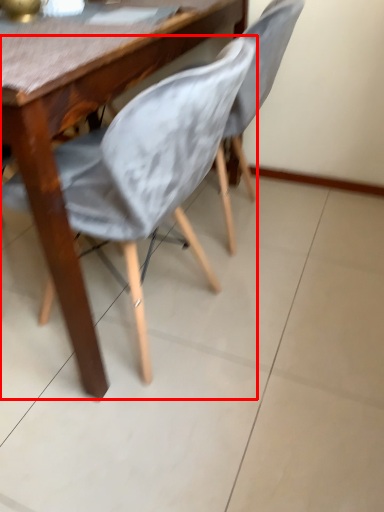
Question: From the image's perspective, where is chair (annotated by the red box) located relative to chair?

Choices:
 (A) above
 (B) below

Answer: (B)